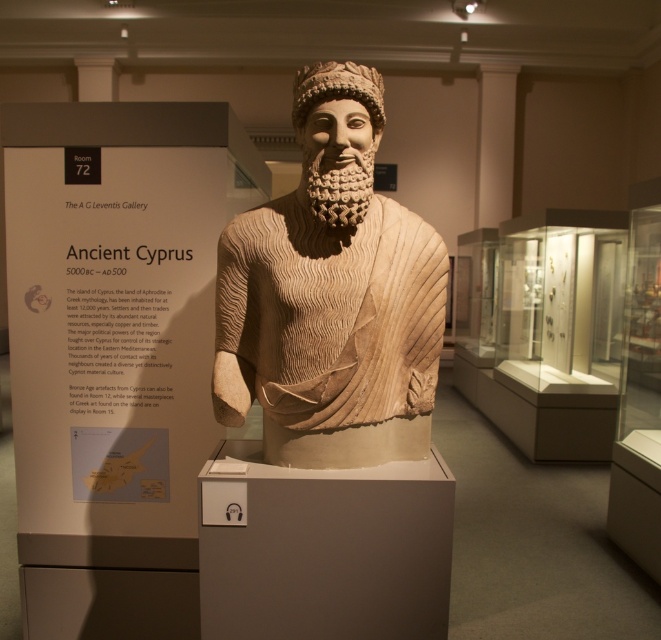
You are a museum visitor who wants to take a photo of the beige stone bust at center and the beige textured beard at center. Which object should you focus on first if you want to capture both in a single frame without moving the camera?

You should focus on the beige stone bust at center first because it is much taller than the beige textured beard at center, so it will occupy more space in the frame.

You are standing in front of the museum exhibit and notice two points marked on the image. Which point, point (336, 307) or point (317, 164), is closer to you?

Point (336, 307) is closer to the viewer than point (317, 164).